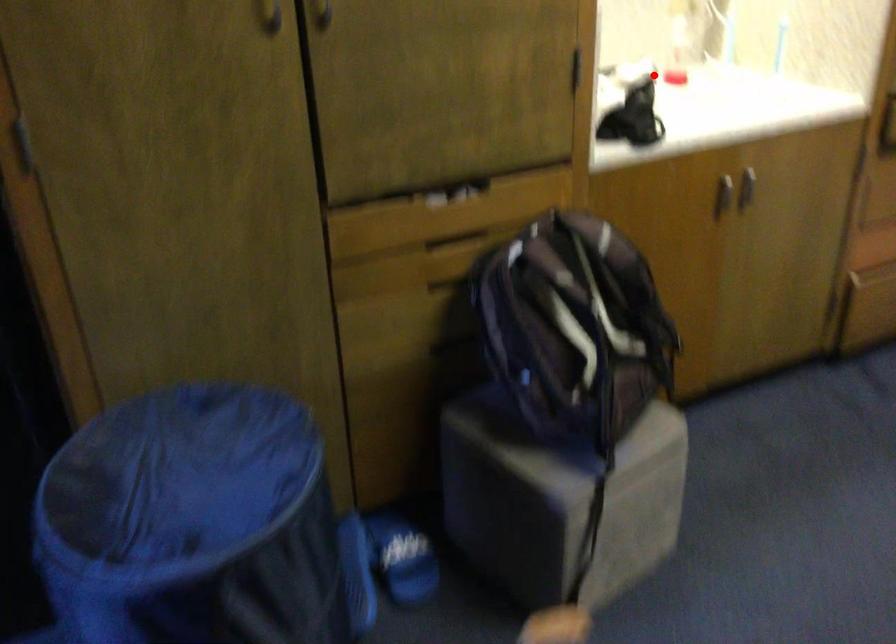
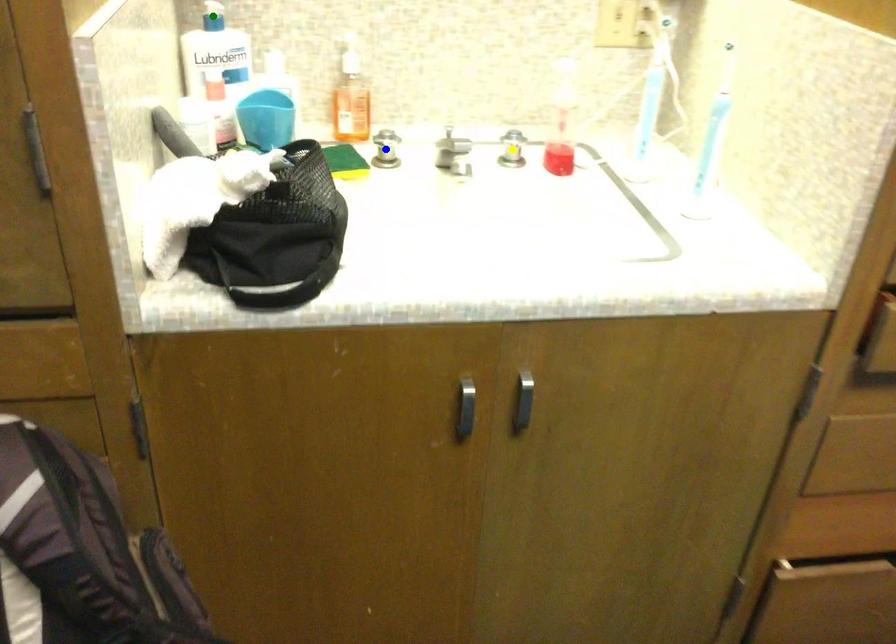
Question: I am providing you with two images of the same scene from different viewpoints. A red point is marked on the first image. You are given multiple points on the second image. In image 2, which mark is for the same physical point as the one in image 1?

Choices:
 (A) blue point
 (B) yellow point
 (C) green point

Answer: (B)